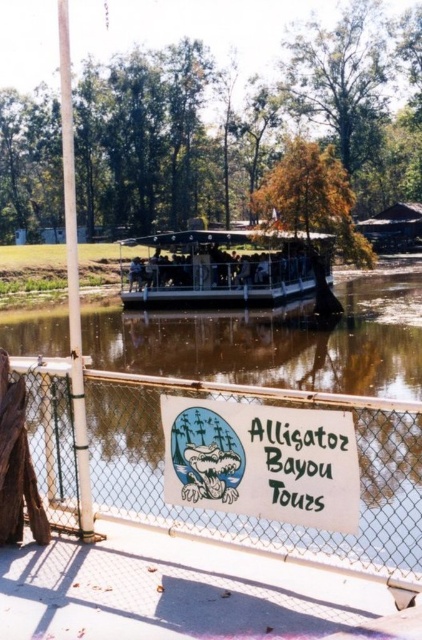
Based on the photo, you are a visitor at Alligator Bayou Tours and want to take a photo of the white paper sign at center and the white plastic boat at center. Since both are white, you want to ensure you capture them clearly. Which object should you focus on first to make sure both are in frame?

The white paper sign at center is positioned on the right side of white plastic boat at center, so you should focus on the white plastic boat at center first to ensure both are in frame.